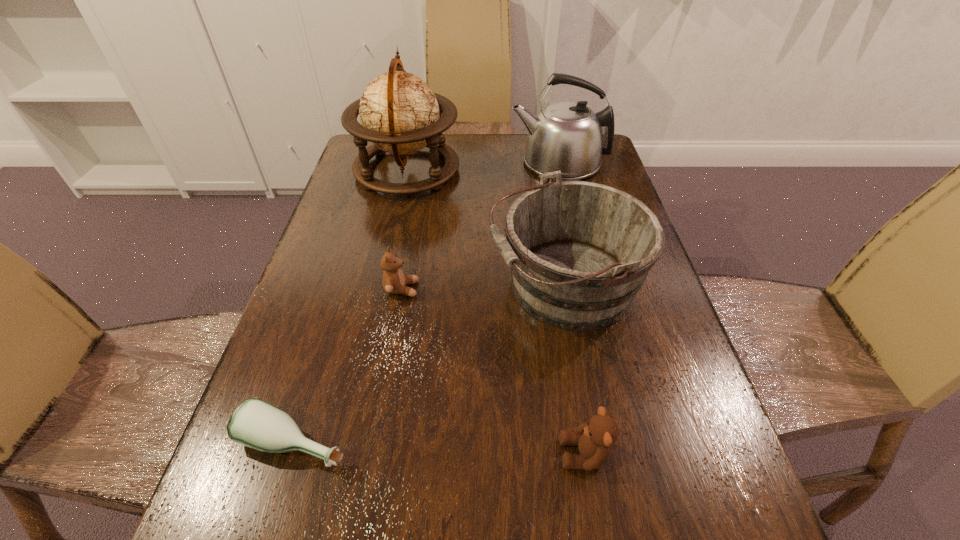
Where is `free point between the tallest object and the left teddy bear`? This screenshot has width=960, height=540. free point between the tallest object and the left teddy bear is located at coordinates (404, 230).

Where is `free spot between the farther teddy bear and the second tallest object`? This screenshot has width=960, height=540. free spot between the farther teddy bear and the second tallest object is located at coordinates (480, 226).

Where is `free area in between the farther teddy bear and the wine bucket`? free area in between the farther teddy bear and the wine bucket is located at coordinates (483, 288).

Image resolution: width=960 pixels, height=540 pixels. I want to click on free area in between the globe and the kettle, so click(x=483, y=167).

This screenshot has height=540, width=960. What are the coordinates of `free spot between the nearer teddy bear and the tallest object` in the screenshot? It's located at (496, 312).

In order to click on free spot between the right teddy bear and the tallest object in this screenshot , I will do `click(496, 312)`.

Find the location of `blank region between the globe and the wine bucket`. blank region between the globe and the wine bucket is located at coordinates (486, 228).

Select which object is the fifth closest to the third tallest object. Please provide its 2D coordinates. Your answer should be formatted as a tuple, i.e. [(x, y)], where the tuple contains the x and y coordinates of a point satisfying the conditions above.

[(255, 423)]

Identify which object is the second nearest to the left teddy bear. Please provide its 2D coordinates. Your answer should be formatted as a tuple, i.e. [(x, y)], where the tuple contains the x and y coordinates of a point satisfying the conditions above.

[(255, 423)]

Image resolution: width=960 pixels, height=540 pixels. In order to click on free space in the image that satisfies the following two spatial constraints: 1. on the front side of the wine bucket; 2. on the face of the nearer teddy bear in this screenshot , I will do `click(595, 454)`.